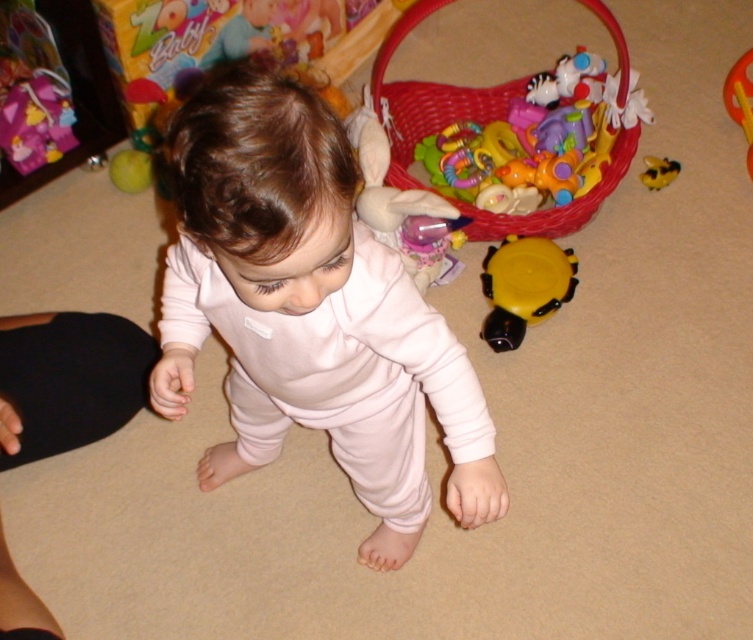
You are a photographer trying to capture a candid shot of the child in the scene. You have a camera that requires a minimum distance of 24 inches to focus properly. The light pink fleece at center is where the child is focused. Is your camera able to focus on the child from your current position?

The light pink fleece at center and camera are 26.31 inches apart. Since the minimum focusing distance required is 24 inches, the camera can focus on the child as the distance is sufficient.

You are a parent trying to decide which toy to give your child. The child is looking at the light pink fleece at center and the yellow matte toy at center. Which one is taller?

The light pink fleece at center is much taller than the yellow matte toy at center.

You are a parent trying to give your child a toy. You have the yellow matte toy at center and the yellow rubber bee at upper right. Which one is bigger?

The yellow matte toy at center is larger in size than the yellow rubber bee at upper right.